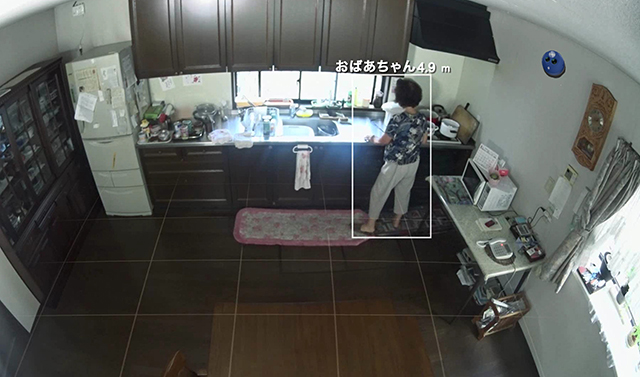
At what (x,y) coordinates should I click in order to perform the action: click on sink. Please return your answer as a coordinate pair (x, y). The height and width of the screenshot is (377, 640). Looking at the image, I should click on (304, 117).